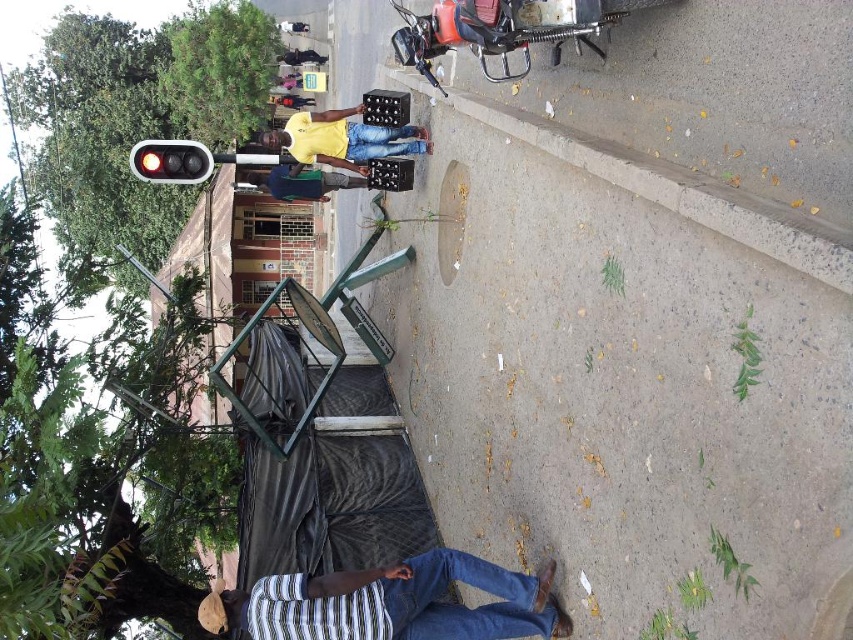
Who is more distant from viewer, (402, 612) or (347, 186)?

Point (347, 186)

Which is more to the left, striped fabric shirt at lower center or dark blue jeans at center?

dark blue jeans at center is more to the left.

Measure the distance between striped fabric shirt at lower center and camera.

striped fabric shirt at lower center and camera are 8.00 meters apart from each other.

Where is `striped fabric shirt at lower center`? This screenshot has width=853, height=640. striped fabric shirt at lower center is located at coordinates (399, 602).

Does concrete at center appear over yellow matte shirt at center?

Actually, concrete at center is below yellow matte shirt at center.

Can you confirm if concrete at center is positioned to the right of yellow matte shirt at center?

Yes, concrete at center is to the right of yellow matte shirt at center.

Where is `concrete at center`? The height and width of the screenshot is (640, 853). concrete at center is located at coordinates (682, 192).

Between point (308, 113) and point (328, 177), which one is positioned behind?

The point (308, 113) is behind.

Which is more to the right, yellow matte shirt at center or dark blue jeans at center?

From the viewer's perspective, yellow matte shirt at center appears more on the right side.

Who is more forward, (387, 144) or (277, 180)?

Positioned in front is point (387, 144).

Identify the location of yellow matte shirt at center. Image resolution: width=853 pixels, height=640 pixels. (343, 138).